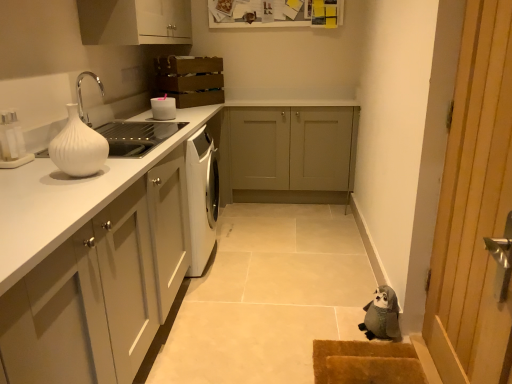
Locate an element on the screen. vacant space in white glossy vase at left (from a real-world perspective) is located at coordinates (82, 174).